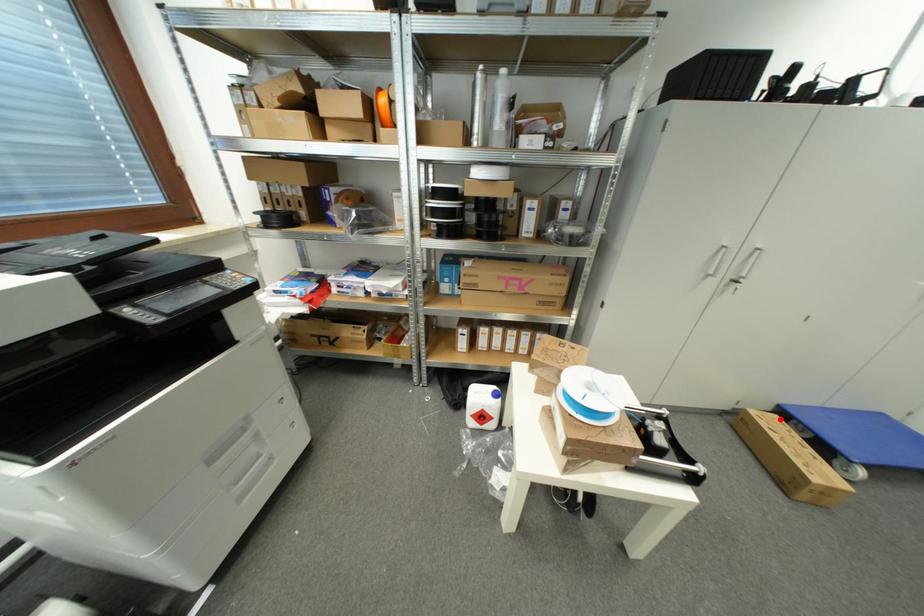
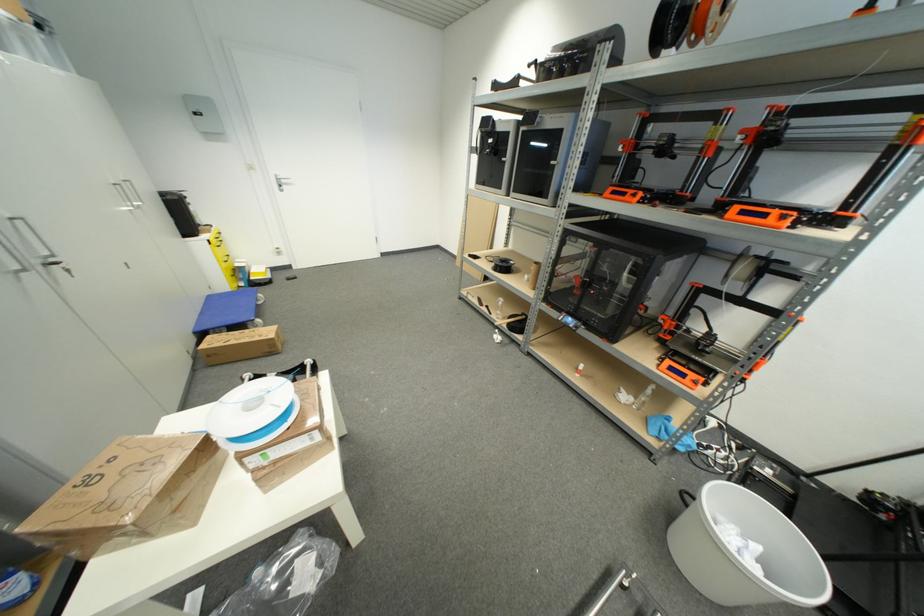
Question: A red point is marked in image1. In image2, is the corresponding 3D point closer to the camera or farther? Reply with the corresponding letter.

Choices:
 (A) The corresponding 3D point is closer.
 (B) The corresponding 3D point is farther.

Answer: (B)